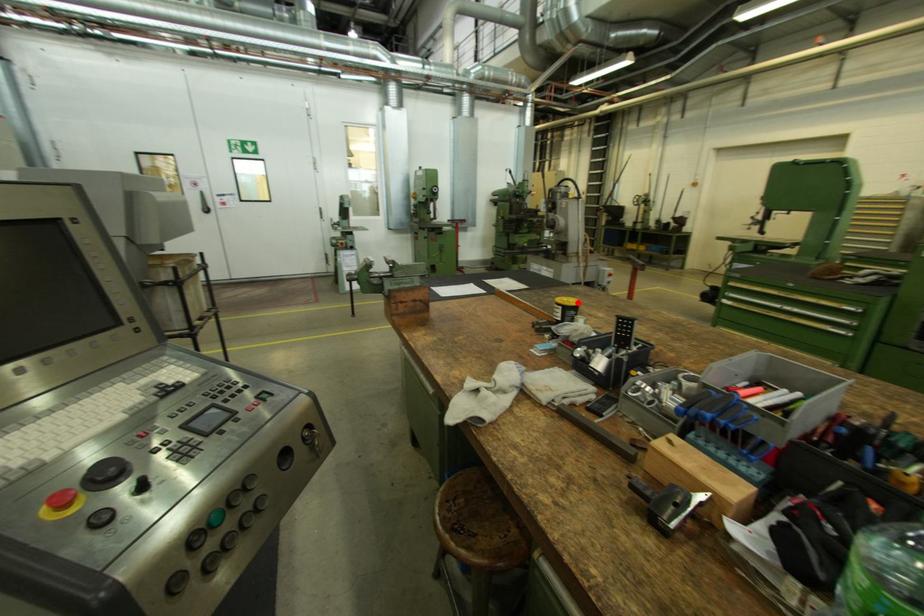
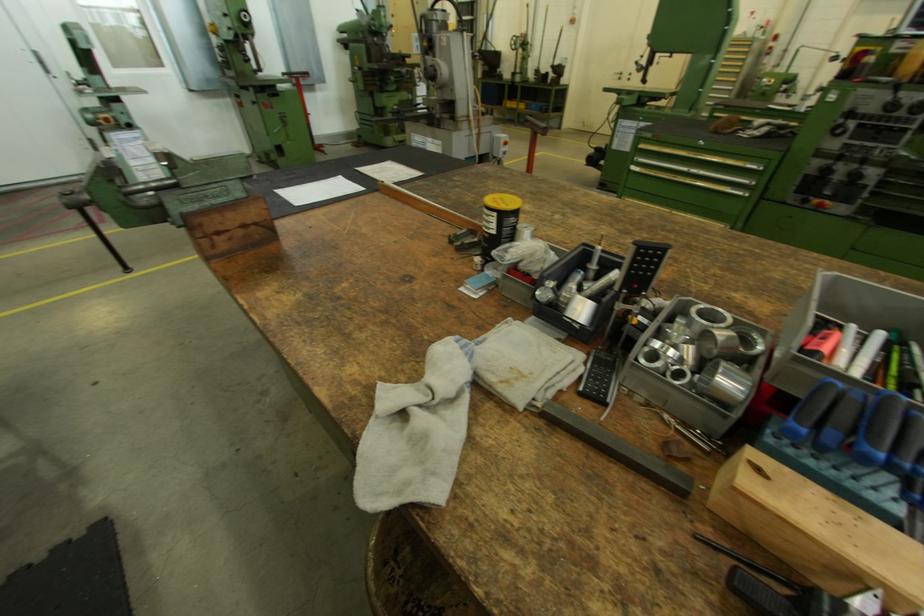
In the second image, find the point that corresponds to the highlighted location in the first image.

(516, 203)